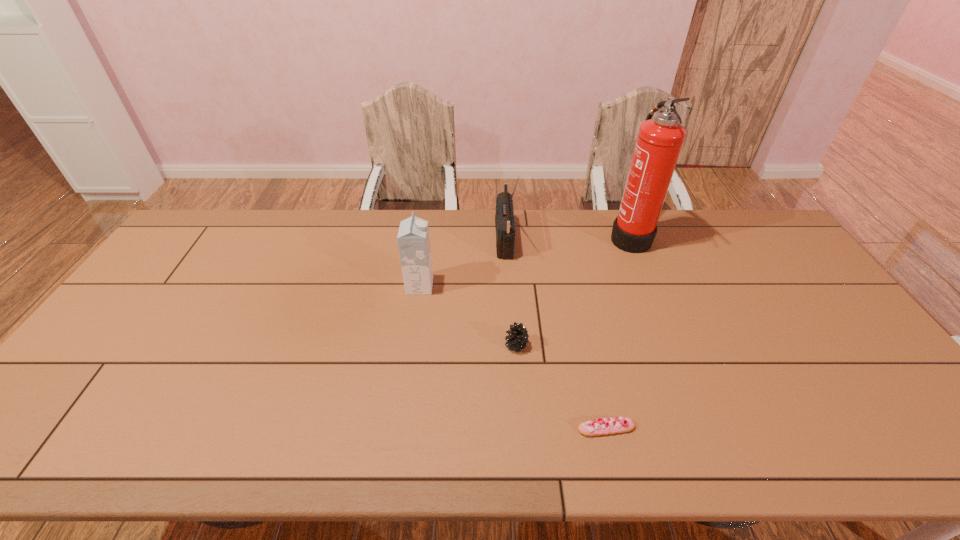
Locate an element on the screen. object that is at the near edge is located at coordinates (602, 426).

This screenshot has width=960, height=540. I want to click on vacant area at the far edge, so 297,219.

What are the coordinates of `free space at the near edge of the desktop` in the screenshot? It's located at (328, 455).

Where is `vacant region at the left edge`? Image resolution: width=960 pixels, height=540 pixels. vacant region at the left edge is located at coordinates (160, 328).

The height and width of the screenshot is (540, 960). In the image, there is a desktop. Find the location of `vacant area at the right edge`. vacant area at the right edge is located at coordinates (778, 267).

In the image, there is a desktop. Where is `free space at the far left corner`? free space at the far left corner is located at coordinates (205, 212).

This screenshot has width=960, height=540. I want to click on vacant space at the far right corner of the desktop, so click(768, 248).

Identify the location of blank space at the near right corner. (875, 452).

At what (x,y) coordinates should I click in order to perform the action: click on unoccupied position between the fire extinguisher and the second tallest object. Please return your answer as a coordinate pair (x, y). The image size is (960, 540). Looking at the image, I should click on (566, 239).

The height and width of the screenshot is (540, 960). Identify the location of blank region between the radio receiver and the fourth farthest object. (510, 293).